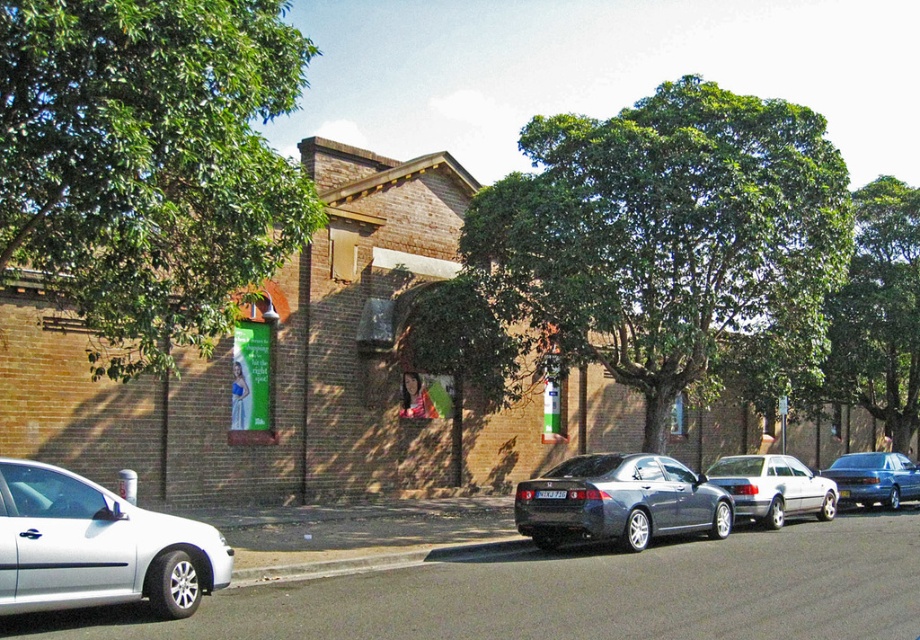
Between green leafy tree at center and silver metallic car at left, which one is positioned lower?

silver metallic car at left

Is point (687, 307) more distant than point (46, 593)?

Yes, it is.

Where is `green leafy tree at center`? Image resolution: width=920 pixels, height=640 pixels. green leafy tree at center is located at coordinates (664, 244).

Can you confirm if green leafy tree at upper right is smaller than silver metallic sedan at center-right?

Actually, green leafy tree at upper right might be larger than silver metallic sedan at center-right.

Can you confirm if green leafy tree at upper right is thinner than silver metallic sedan at center-right?

In fact, green leafy tree at upper right might be wider than silver metallic sedan at center-right.

You are a GUI agent. You are given a task and a screenshot of the screen. Output one action in this format:
    pyautogui.click(x=<x>, y=<y>)
    Task: Click on the green leafy tree at upper right
    Image resolution: width=920 pixels, height=640 pixels.
    Given the screenshot: What is the action you would take?
    pyautogui.click(x=880, y=310)

In the scene shown: Is satin dark gray sedan at center above metallic blue sedan at center?

Correct, satin dark gray sedan at center is located above metallic blue sedan at center.

Identify the location of satin dark gray sedan at center. (619, 500).

Locate an element on the screen. satin dark gray sedan at center is located at coordinates (619, 500).